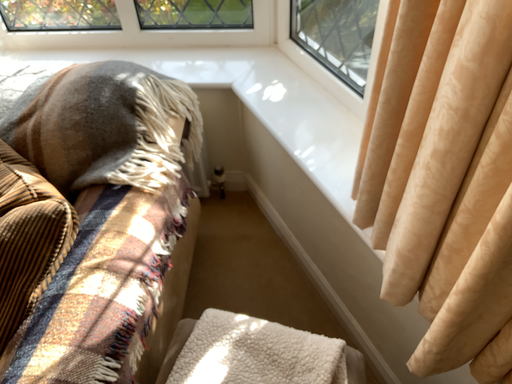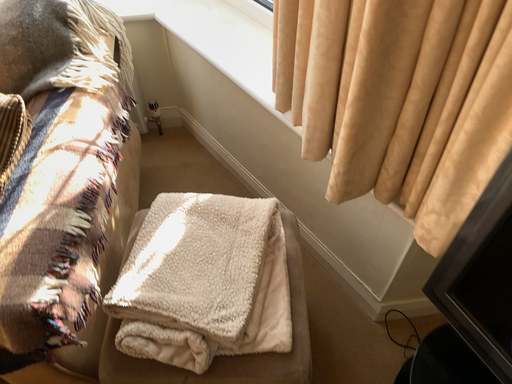
Question: Which way did the camera rotate in the video?

Choices:
 (A) rotated right
 (B) rotated left

Answer: (A)